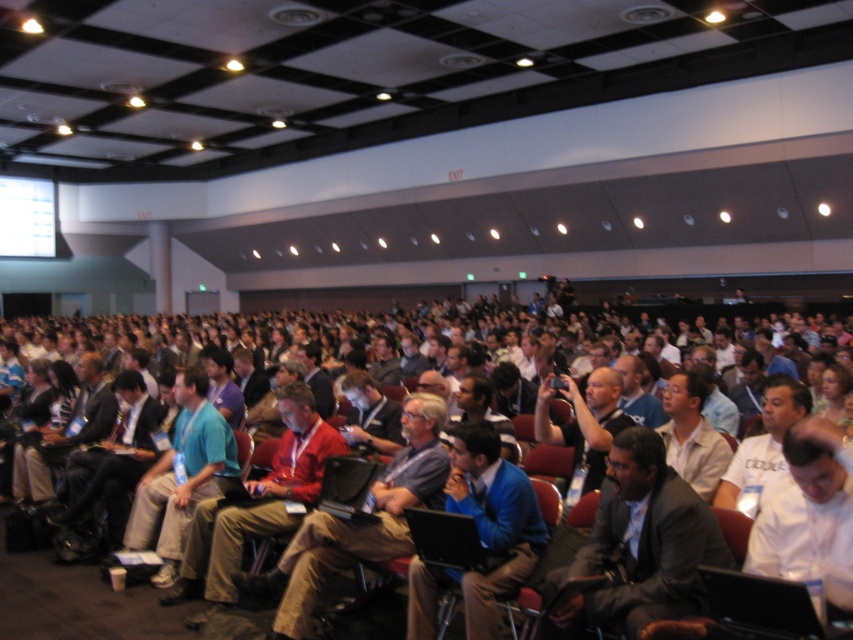
Question: Can you confirm if dark gray suit at center is thinner than red fabric shirt at center?

Choices:
 (A) no
 (B) yes

Answer: (B)

Question: Among these objects, which one is farthest from the camera?

Choices:
 (A) blue fabric shirt at center
 (B) dark gray suit at center
 (C) red fabric shirt at center

Answer: (C)

Question: Estimate the real-world distances between objects in this image. Which object is farther from the red fabric shirt at center?

Choices:
 (A) blue fabric shirt at center
 (B) dark gray suit at center

Answer: (B)

Question: Considering the relative positions of dark gray suit at center and blue fabric shirt at center in the image provided, where is dark gray suit at center located with respect to blue fabric shirt at center?

Choices:
 (A) left
 (B) right

Answer: (B)

Question: Can you confirm if blue fabric shirt at center is bigger than red fabric shirt at center?

Choices:
 (A) no
 (B) yes

Answer: (A)

Question: Which object appears closest to the camera in this image?

Choices:
 (A) dark gray suit at center
 (B) red fabric shirt at center

Answer: (A)